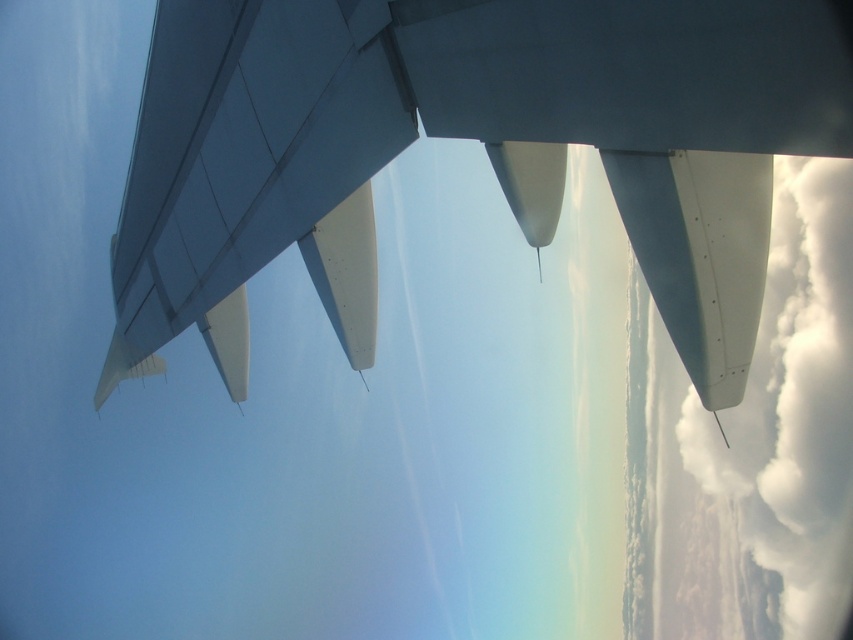
Is point (827, 1) less distant than point (299, 154)?

Yes, it is in front of point (299, 154).

Can you confirm if matte white wing at upper center is thinner than matte white wing at upper left?

No.

Measure the distance between point (231, 70) and camera.

They are 13.00 meters apart.

Locate an element on the screen. This screenshot has height=640, width=853. matte white wing at upper center is located at coordinates (465, 138).

Which of these two, matte white wing at upper left or white fluffy cloud at right, stands shorter?

matte white wing at upper left is shorter.

Can you confirm if matte white wing at upper left is taller than white fluffy cloud at right?

Incorrect, matte white wing at upper left's height is not larger of white fluffy cloud at right's.

This screenshot has height=640, width=853. Describe the element at coordinates (253, 172) in the screenshot. I see `matte white wing at upper left` at that location.

Image resolution: width=853 pixels, height=640 pixels. Identify the location of matte white wing at upper left. (253, 172).

Who is shorter, matte white wing at upper center or white fluffy cloud at right?

With less height is matte white wing at upper center.

Does point (755, 232) lie behind point (833, 557)?

No.

Is point (679, 275) positioned before point (833, 371)?

Yes, point (679, 275) is closer to viewer.

Locate an element on the screen. The image size is (853, 640). matte white wing at upper center is located at coordinates (465, 138).